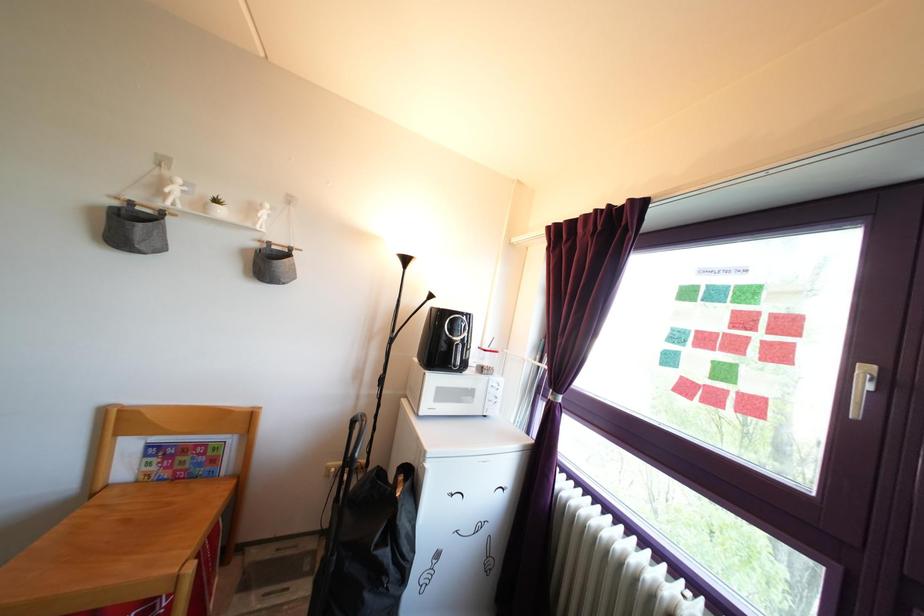
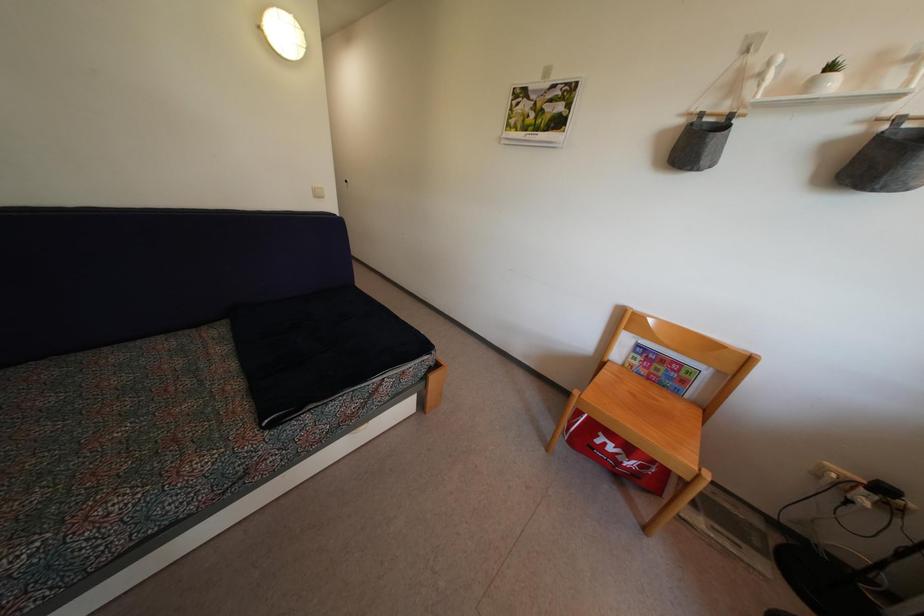
Find the pixel in the second image that matches point 219,209 in the first image.

(833, 76)